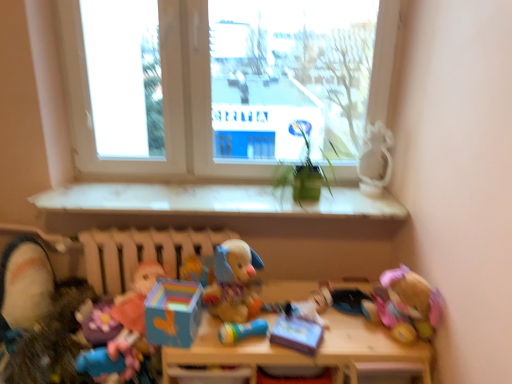
I want to click on vacant area situated below green matte plant at center (from a real-world perspective), so click(x=305, y=201).